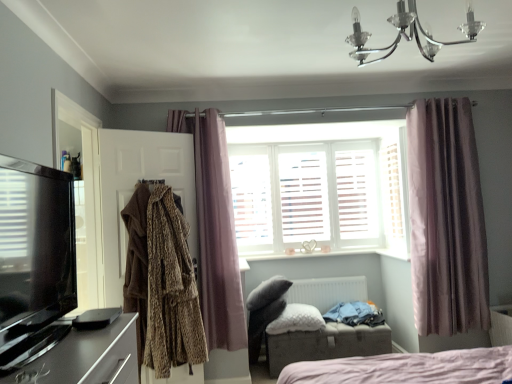
The width and height of the screenshot is (512, 384). In order to click on black glossy tv at left in this screenshot , I will do `click(49, 288)`.

What is the approximate width of black glossy tv at left?

black glossy tv at left is 3.97 inches in width.

The height and width of the screenshot is (384, 512). I want to click on gray fabric ottoman at lower center, so click(x=326, y=344).

What is the approximate width of purple silky curtain at right, which is counted as the 1th curtain, starting from the right?

7.68 inches.

This screenshot has height=384, width=512. Describe the element at coordinates (327, 291) in the screenshot. I see `white matte radiator at center` at that location.

The image size is (512, 384). Find the location of `chrome/crystal chandelier at upper center`. chrome/crystal chandelier at upper center is located at coordinates pyautogui.click(x=407, y=34).

Considering the sizes of chrome/crystal chandelier at upper center and white wooden shutters at center in the image, is chrome/crystal chandelier at upper center wider or thinner than white wooden shutters at center?

Clearly, chrome/crystal chandelier at upper center has more width compared to white wooden shutters at center.

Measure the distance from chrome/crystal chandelier at upper center to white wooden shutters at center.

chrome/crystal chandelier at upper center and white wooden shutters at center are 5.42 feet apart from each other.

Is chrome/crystal chandelier at upper center far from white wooden shutters at center?

Yes, chrome/crystal chandelier at upper center and white wooden shutters at center are quite far apart.

From a real-world perspective, between chrome/crystal chandelier at upper center and white wooden shutters at center, who is vertically higher?

chrome/crystal chandelier at upper center.

Locate an element on the screen. the 2nd clothing below the purple velvet curtain at left, positioned as the 2th curtain in right-to-left order (from the image's perspective) is located at coordinates (355, 314).

Considering the points (369, 303) and (227, 305), which point is in front, point (369, 303) or point (227, 305)?

Point (227, 305)

From a real-world perspective, does blue cotton shirt at lower right, the first clothing positioned from the back, sit lower than purple velvet curtain at left, positioned as the 2th curtain in right-to-left order?

Yes, from a real-world perspective, blue cotton shirt at lower right, the first clothing positioned from the back, is below purple velvet curtain at left, positioned as the 2th curtain in right-to-left order.

Can you confirm if blue cotton shirt at lower right, acting as the first clothing starting from the bottom, is thinner than purple velvet curtain at left, positioned as the 2th curtain in right-to-left order?

In fact, blue cotton shirt at lower right, acting as the first clothing starting from the bottom, might be wider than purple velvet curtain at left, positioned as the 2th curtain in right-to-left order.

Is black glossy speaker at lower left smaller than white wooden shutters at center?

Indeed, black glossy speaker at lower left has a smaller size compared to white wooden shutters at center.

From the image's perspective, is black glossy speaker at lower left positioned above or below white wooden shutters at center?

From the image's perspective, black glossy speaker at lower left appears below white wooden shutters at center.

Can you tell me how much black glossy speaker at lower left and white wooden shutters at center differ in facing direction?

They differ by 89.1 degrees in their facing directions.

Can you confirm if black glossy speaker at lower left is thinner than white wooden shutters at center?

No.

Looking at this image, considering the sizes of objects chrome/crystal chandelier at upper center and white matte radiator at center in the image provided, who is wider, chrome/crystal chandelier at upper center or white matte radiator at center?

Wider between the two is chrome/crystal chandelier at upper center.

From the image's perspective, between chrome/crystal chandelier at upper center and white matte radiator at center, which one is located above?

chrome/crystal chandelier at upper center.

Is chrome/crystal chandelier at upper center inside or outside of white matte radiator at center?

chrome/crystal chandelier at upper center is not inside white matte radiator at center, it's outside.

Visually, is chrome/crystal chandelier at upper center positioned to the left or to the right of white matte radiator at center?

From the image, it's evident that chrome/crystal chandelier at upper center is to the left of white matte radiator at center.

Is purple silky curtain at right, which is counted as the 1th curtain, starting from the right, in front of or behind gray fabric ottoman at lower center in the image?

In the image, purple silky curtain at right, which is counted as the 1th curtain, starting from the right, appears in front of gray fabric ottoman at lower center.

Between purple silky curtain at right, which is counted as the 1th curtain, starting from the right, and gray fabric ottoman at lower center, which one appears on the right side from the viewer's perspective?

purple silky curtain at right, which is counted as the 1th curtain, starting from the right.

Which object is wider, purple silky curtain at right, which is counted as the 1th curtain, starting from the right, or gray fabric ottoman at lower center?

With larger width is gray fabric ottoman at lower center.

From the image's perspective, which object appears higher, purple silky curtain at right, which is counted as the 1th curtain, starting from the right, or gray fabric ottoman at lower center?

purple silky curtain at right, which is counted as the 1th curtain, starting from the right.

Where is `appliance on the left of the white matte radiator at center`? Image resolution: width=512 pixels, height=384 pixels. appliance on the left of the white matte radiator at center is located at coordinates (96, 318).

Based on their sizes in the image, would you say white matte radiator at center is bigger or smaller than black glossy speaker at lower left?

Considering their sizes, white matte radiator at center takes up more space than black glossy speaker at lower left.

Is white matte radiator at center in front of black glossy speaker at lower left?

No, white matte radiator at center is further to the viewer.

From the image's perspective, which one is positioned lower, white matte radiator at center or black glossy speaker at lower left?

From the image's view, white matte radiator at center is below.

Is point (42, 246) closer to camera compared to point (442, 305)?

That is True.

Looking at the image, does black glossy tv at left seem bigger or smaller compared to purple silky curtain at right, which is counted as the 1th curtain, starting from the right?

Considering their sizes, black glossy tv at left takes up less space than purple silky curtain at right, which is counted as the 1th curtain, starting from the right.

From a real-world perspective, is black glossy tv at left positioned over purple silky curtain at right, placed as the second curtain when sorted from left to right, based on gravity?

Indeed, from a real-world perspective, black glossy tv at left stands above purple silky curtain at right, placed as the second curtain when sorted from left to right.

The image size is (512, 384). In the image, there is a purple silky curtain at right, placed as the second curtain when sorted from left to right. Find the location of `entertainment center below it (from the image's perspective)`. entertainment center below it (from the image's perspective) is located at coordinates (49, 288).

Locate an element on the screen. The width and height of the screenshot is (512, 384). light fixture that appears above the white wooden shutters at center (from the image's perspective) is located at coordinates (407, 34).

Which curtain is the 2nd one when counting from the front of the blue cotton shirt at lower right, the second clothing from the front? Please provide its 2D coordinates.

[(215, 230)]

Considering their positions, is purple silky curtain at right, placed as the second curtain when sorted from left to right, positioned closer to brown textured coat at left, which is counted as the first clothing, starting from the top, than white wooden shutters at center?

Among the two, white wooden shutters at center is located nearer to brown textured coat at left, which is counted as the first clothing, starting from the top.

Based on their spatial positions, is blue cotton shirt at lower right, acting as the first clothing starting from the bottom, or black glossy speaker at lower left further from white matte radiator at center?

The object further to white matte radiator at center is black glossy speaker at lower left.

Based on their spatial positions, is white wooden shutters at center or white fluffy pillow at center further from black glossy tv at left?

The object further to black glossy tv at left is white wooden shutters at center.

Which object lies nearer to the anchor point chrome/crystal chandelier at upper center, black glossy tv at left or blue cotton shirt at lower right, acting as the first clothing starting from the bottom?

black glossy tv at left lies closer to chrome/crystal chandelier at upper center than the other object.

From the image, which object appears to be nearer to black glossy tv at left, white fluffy pillow at center or black glossy speaker at lower left?

black glossy speaker at lower left lies closer to black glossy tv at left than the other object.

From the image, which object appears to be farther from chrome/crystal chandelier at upper center, purple silky curtain at right, which is counted as the 1th curtain, starting from the right, or white fluffy pillow at center?

Based on the image, white fluffy pillow at center appears to be further to chrome/crystal chandelier at upper center.

From the image, which object appears to be farther from black glossy speaker at lower left, white wooden shutters at center or blue cotton shirt at lower right, which is the 2th clothing in left-to-right order?

Based on the image, white wooden shutters at center appears to be further to black glossy speaker at lower left.

Considering their positions, is gray fabric ottoman at lower center positioned further to chrome/crystal chandelier at upper center than white matte radiator at center?

gray fabric ottoman at lower center is positioned further to the anchor chrome/crystal chandelier at upper center.

Identify the location of furniture located between black glossy speaker at lower left and blue cotton shirt at lower right, the second clothing from the front, in the depth direction. This screenshot has width=512, height=384. (326, 344).

Locate an element on the screen. This screenshot has height=384, width=512. radiator that lies between purple silky curtain at right, placed as the second curtain when sorted from left to right, and blue cotton shirt at lower right, the second clothing from the front, from top to bottom is located at coordinates (327, 291).

You are a GUI agent. You are given a task and a screenshot of the screen. Output one action in this format:
    pyautogui.click(x=<x>, y=<y>)
    Task: Click on the appliance between chrome/crystal chandelier at upper center and gray fabric ottoman at lower center from front to back
    The width and height of the screenshot is (512, 384).
    Given the screenshot: What is the action you would take?
    pyautogui.click(x=96, y=318)

At what (x,y) coordinates should I click in order to perform the action: click on clothing between black glossy tv at left and purple velvet curtain at left, positioned as the 2th curtain in right-to-left order, along the z-axis. Please return your answer as a coordinate pair (x, y). This screenshot has height=384, width=512. Looking at the image, I should click on (162, 281).